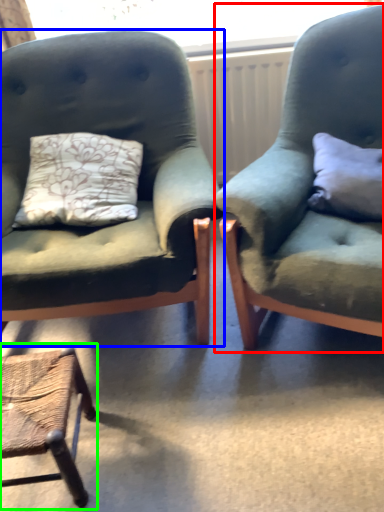
Question: Considering the real-world distances, which object is farthest from chair (highlighted by a red box)? chair (highlighted by a blue box) or chair (highlighted by a green box)?

Choices:
 (A) chair
 (B) chair

Answer: (B)